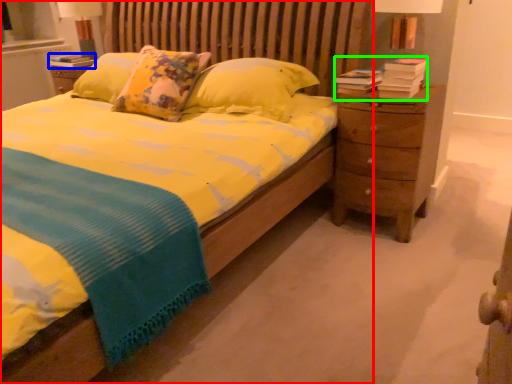
Question: Which object is positioned farthest from bed (highlighted by a red box)? Select from book (highlighted by a blue box) and book (highlighted by a green box).

Choices:
 (A) book
 (B) book

Answer: (A)